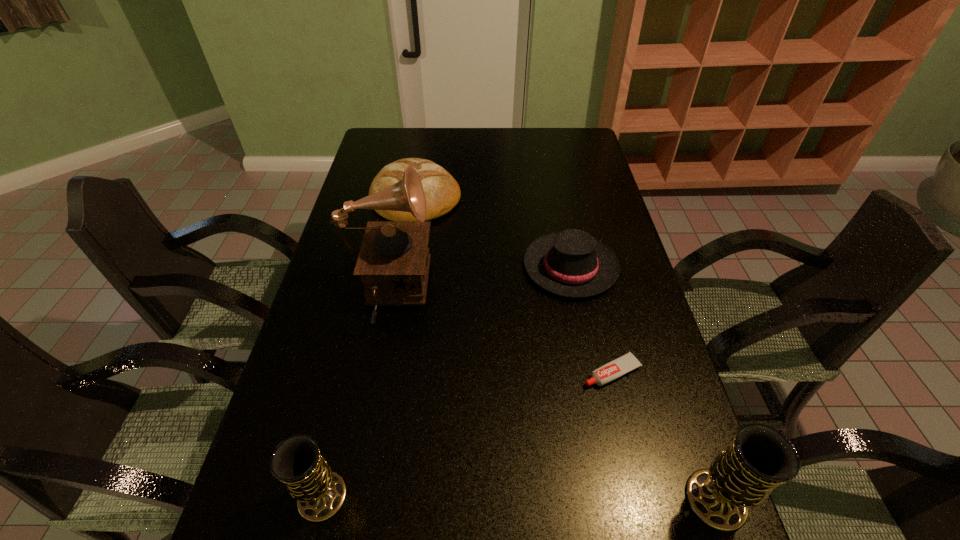
Locate an element on the screen. This screenshot has height=540, width=960. free space located 0.230m on the back of the second tallest object is located at coordinates (671, 372).

The height and width of the screenshot is (540, 960). Find the location of `vacant space located on the horn of the record player`. vacant space located on the horn of the record player is located at coordinates tap(457, 294).

Identify the location of vacant space situated on the front of the shortest object. The height and width of the screenshot is (540, 960). (631, 454).

Image resolution: width=960 pixels, height=540 pixels. Identify the location of vacant space located on the back of the farthest object. (425, 140).

Image resolution: width=960 pixels, height=540 pixels. What are the coordinates of `vacant area situated on the front of the dress hat` in the screenshot? It's located at (602, 424).

At what (x,y) coordinates should I click in order to perform the action: click on chalice that is at the left edge. Please return your answer as a coordinate pair (x, y). Image resolution: width=960 pixels, height=540 pixels. Looking at the image, I should click on (320, 492).

Where is `record player situated at the left edge`? Image resolution: width=960 pixels, height=540 pixels. record player situated at the left edge is located at coordinates (393, 262).

Where is `bread positioned at the left edge`? bread positioned at the left edge is located at coordinates 442,192.

What are the coordinates of `chalice that is at the right edge` in the screenshot? It's located at (760, 458).

The height and width of the screenshot is (540, 960). Find the location of `toothpaste that is at the right edge`. toothpaste that is at the right edge is located at coordinates point(628,362).